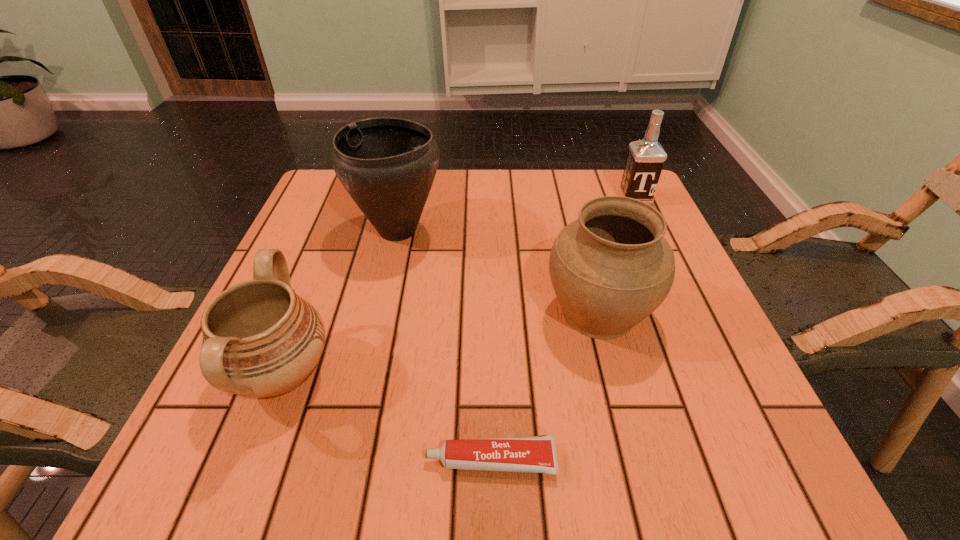
Locate an element on the screen. The width and height of the screenshot is (960, 540). vacant point located between the farthest urn and the third object from left to right is located at coordinates (444, 345).

Point out which object is positioned as the second nearest to the farthest urn. Please provide its 2D coordinates. Your answer should be formatted as a tuple, i.e. [(x, y)], where the tuple contains the x and y coordinates of a point satisfying the conditions above.

[(611, 268)]

Find the location of a particular element. object that is the closest one to the toothpaste is located at coordinates (611, 268).

Where is `urn that is the third closest to the toothpaste`? urn that is the third closest to the toothpaste is located at coordinates (387, 165).

Locate an element on the screen. The height and width of the screenshot is (540, 960). the second closest urn to the farthest urn is located at coordinates (611, 268).

I want to click on vacant space that satisfies the following two spatial constraints: 1. on the front label of the vodka; 2. at the nozzle of the nearest object, so click(756, 460).